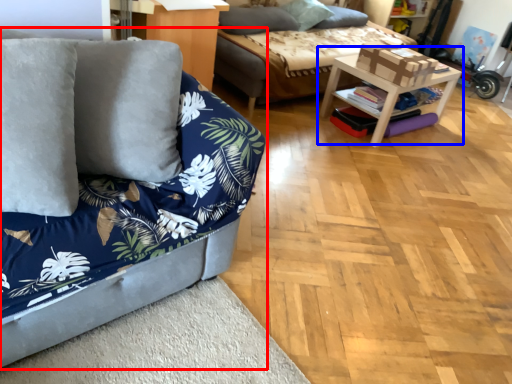
Question: Among these objects, which one is nearest to the camera, studio couch (highlighted by a red box) or table (highlighted by a blue box)?

Choices:
 (A) studio couch
 (B) table

Answer: (A)